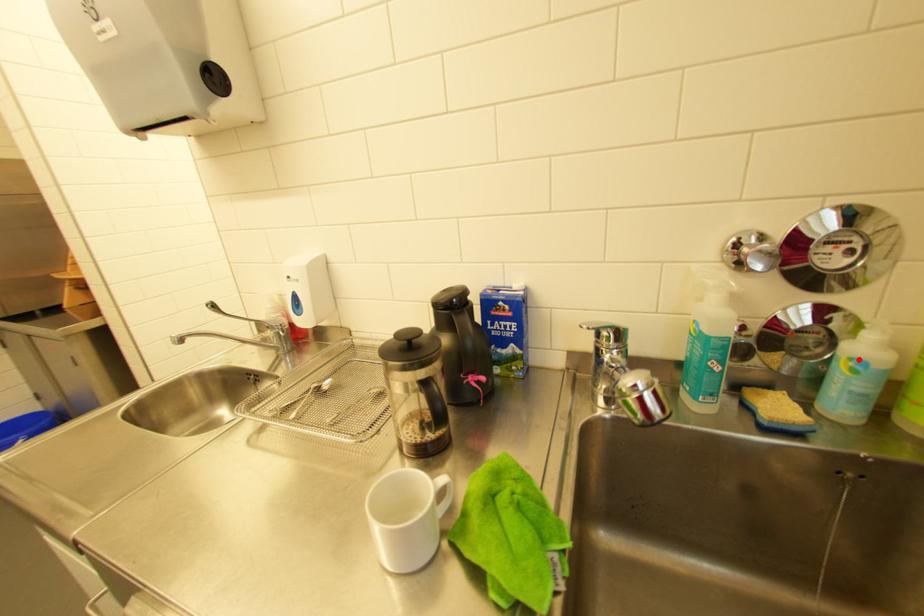
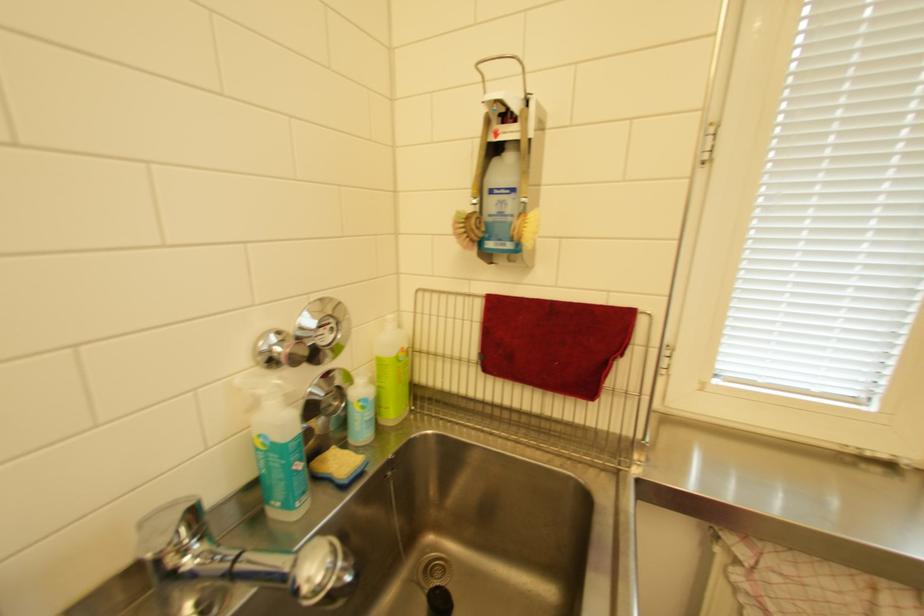
The point at the highlighted location is marked in the first image. Where is the corresponding point in the second image?

(367, 400)